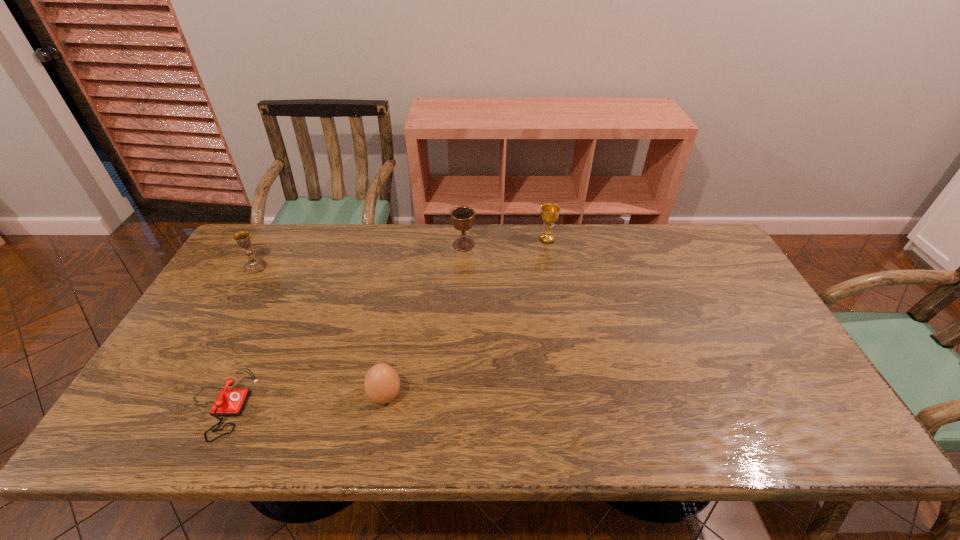
Identify the location of free space between the leftmost object and the fourth object from left to right. (359, 255).

Locate an element on the screen. This screenshot has height=540, width=960. vacant area between the telephone and the third object from left to right is located at coordinates click(302, 400).

What are the coordinates of `free space between the leftmost object and the second object from right to left` in the screenshot? It's located at click(359, 255).

This screenshot has width=960, height=540. Identify the location of object that can be found as the closest to the second object from left to right. (381, 383).

Where is `the third closest object to the leftmost object`? the third closest object to the leftmost object is located at coordinates point(462,217).

Image resolution: width=960 pixels, height=540 pixels. I want to click on chalice that stands as the closest to the third object from right to left, so click(462, 217).

This screenshot has width=960, height=540. Find the location of `the second closest chalice to the leftmost chalice`. the second closest chalice to the leftmost chalice is located at coordinates (549, 212).

You are a GUI agent. You are given a task and a screenshot of the screen. Output one action in this format:
    pyautogui.click(x=<x>, y=<y>)
    Task: Click on the free space that satisfies the following two spatial constraints: 1. on the front side of the boiled egg; 2. on the right side of the third farthest object
    
    Given the screenshot: What is the action you would take?
    pyautogui.click(x=180, y=396)